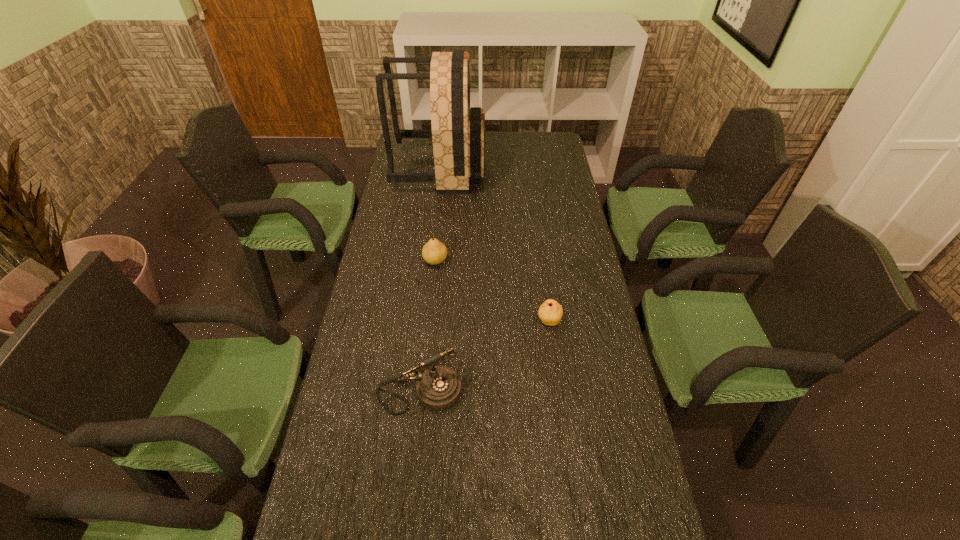
You are a GUI agent. You are given a task and a screenshot of the screen. Output one action in this format:
    pyautogui.click(x=<x>, y=<y>)
    Task: Click on the vacant region between the telephone and the farther pear
    
    Given the screenshot: What is the action you would take?
    pyautogui.click(x=427, y=327)

Identify the location of vacant space that's between the left pear and the right pear. The width and height of the screenshot is (960, 540). (492, 291).

Where is `vacant area that lies between the nearest object and the second farthest object`? The image size is (960, 540). vacant area that lies between the nearest object and the second farthest object is located at coordinates coord(427,327).

This screenshot has width=960, height=540. I want to click on vacant region between the telephone and the shorter pear, so coord(484,357).

The height and width of the screenshot is (540, 960). What are the coordinates of `blank region between the nearest object and the nearer pear` in the screenshot? It's located at (484, 357).

This screenshot has width=960, height=540. In order to click on vacant area that lies between the backpack and the nearer pear in this screenshot , I will do `click(494, 245)`.

In order to click on object that is the third closest to the nearest object in this screenshot , I will do coord(458,133).

Locate an element on the screen. Image resolution: width=960 pixels, height=540 pixels. object that is the second closest to the tallest object is located at coordinates (550, 312).

Image resolution: width=960 pixels, height=540 pixels. Find the location of `the closest pear to the tallest object`. the closest pear to the tallest object is located at coordinates (434, 252).

Locate an element on the screen. the second closest pear to the nearest object is located at coordinates (434, 252).